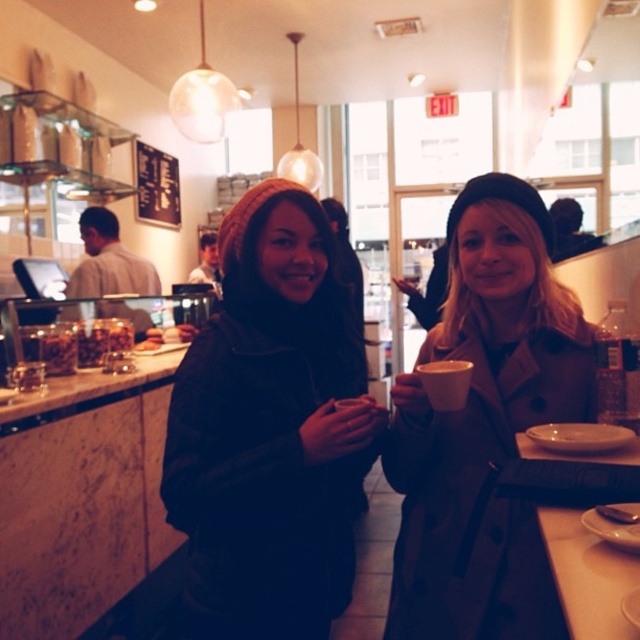
Question: Among these objects, which one is farthest from the camera?

Choices:
 (A) matte black beanie at center
 (B) matte gray coat at center

Answer: (A)

Question: Can you confirm if matte gray coat at center is positioned below clear plastic bottle at right?

Choices:
 (A) yes
 (B) no

Answer: (A)

Question: Among these objects, which one is farthest from the camera?

Choices:
 (A) matte gray coat at center
 (B) clear plastic bottle at right
 (C) matte black beanie at center

Answer: (B)

Question: Which object is positioned closest to the matte black beanie at center?

Choices:
 (A) clear plastic bottle at right
 (B) matte gray coat at center

Answer: (B)

Question: Does matte black beanie at center have a larger size compared to matte gray coat at center?

Choices:
 (A) yes
 (B) no

Answer: (A)

Question: In this image, where is matte black beanie at center located relative to matte gray coat at center?

Choices:
 (A) left
 (B) right

Answer: (A)